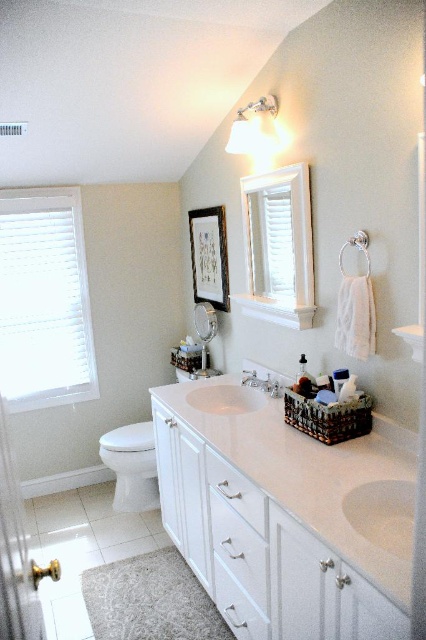
Question: Which point appears closest to the camera in this image?

Choices:
 (A) (0, 593)
 (B) (195, 316)

Answer: (A)

Question: Which of these objects is positioned farthest from the white glossy countertop at center?

Choices:
 (A) satin nickel faucet at center
 (B) clear glass screen door at lower left
 (C) white glossy toilet bowl at lower left
 (D) matte silver mirror at center

Answer: (C)

Question: Is matte silver mirror at center to the left of matte glass mirror at upper center from the viewer's perspective?

Choices:
 (A) yes
 (B) no

Answer: (A)

Question: Is white glossy sink at center bigger than matte silver mirror at center?

Choices:
 (A) no
 (B) yes

Answer: (A)

Question: Which of the following is the closest to the observer?

Choices:
 (A) (37, 577)
 (B) (120, 486)
 (C) (212, 305)

Answer: (A)

Question: Is clear glass screen door at lower left below white glossy toilet bowl at lower left?

Choices:
 (A) yes
 (B) no

Answer: (B)